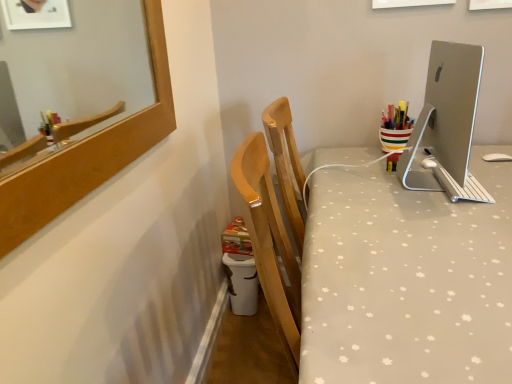
Question: Does silver metallic monitor at upper right come in front of white dotted fabric at center?

Choices:
 (A) yes
 (B) no

Answer: (B)

Question: Is silver metallic monitor at upper right touching white dotted fabric at center?

Choices:
 (A) yes
 (B) no

Answer: (B)

Question: Is the position of silver metallic monitor at upper right more distant than that of white dotted fabric at center?

Choices:
 (A) yes
 (B) no

Answer: (A)

Question: Could white dotted fabric at center be considered to be inside silver metallic monitor at upper right?

Choices:
 (A) no
 (B) yes

Answer: (A)

Question: Can you confirm if silver metallic monitor at upper right is wider than white dotted fabric at center?

Choices:
 (A) yes
 (B) no

Answer: (B)

Question: From the image's perspective, would you say silver metallic monitor at upper right is shown under white dotted fabric at center?

Choices:
 (A) yes
 (B) no

Answer: (B)

Question: From the image's perspective, would you say white dotted fabric at center is positioned over silver metallic monitor at upper right?

Choices:
 (A) yes
 (B) no

Answer: (B)

Question: From a real-world perspective, is white dotted fabric at center positioned under silver metallic monitor at upper right based on gravity?

Choices:
 (A) no
 (B) yes

Answer: (B)

Question: Is white dotted fabric at center behind silver metallic monitor at upper right?

Choices:
 (A) no
 (B) yes

Answer: (A)

Question: Does white dotted fabric at center have a smaller size compared to silver metallic monitor at upper right?

Choices:
 (A) no
 (B) yes

Answer: (A)

Question: Can you see white dotted fabric at center touching silver metallic monitor at upper right?

Choices:
 (A) yes
 (B) no

Answer: (B)

Question: Does white dotted fabric at center lie in front of silver metallic monitor at upper right?

Choices:
 (A) yes
 (B) no

Answer: (A)

Question: Is point (415, 130) positioned closer to the camera than point (328, 380)?

Choices:
 (A) farther
 (B) closer

Answer: (A)